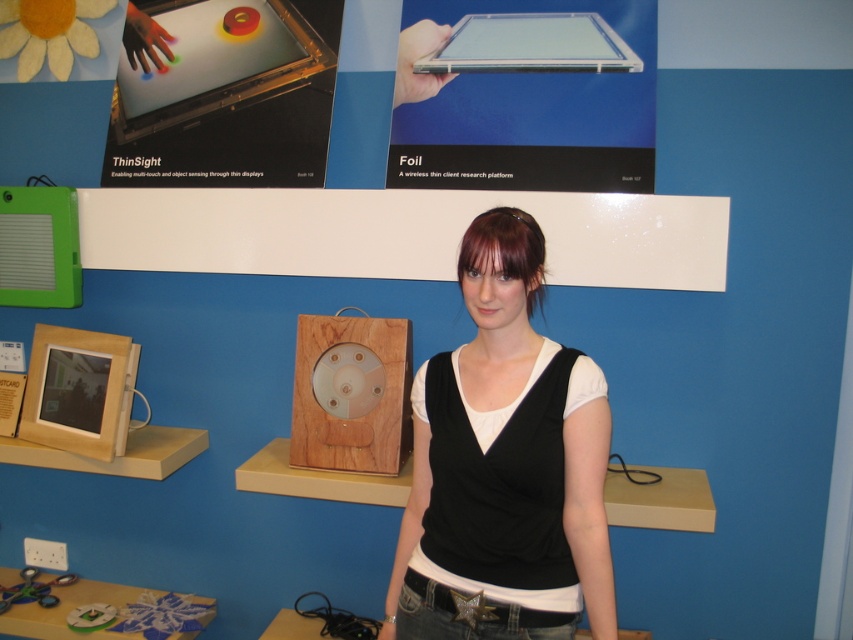
Looking at this image, you are a photographer trying to capture the black matte tank top at center and the wooden clock at center in the same frame. Which object should you zoom in on to ensure both are visible without cropping?

The black matte tank top at center is wider than the wooden clock at center, so you should zoom out to include both objects in the frame.

You are standing in the exhibition and see two points marked on the wall behind the woman. Which point is closer to you, point 1 at coordinates (x=569, y=390) or point 2 at coordinates (x=408, y=362)?

Point 1 at coordinates (x=569, y=390) is closer to you because it is in front of point 2 at coordinates (x=408, y=362).